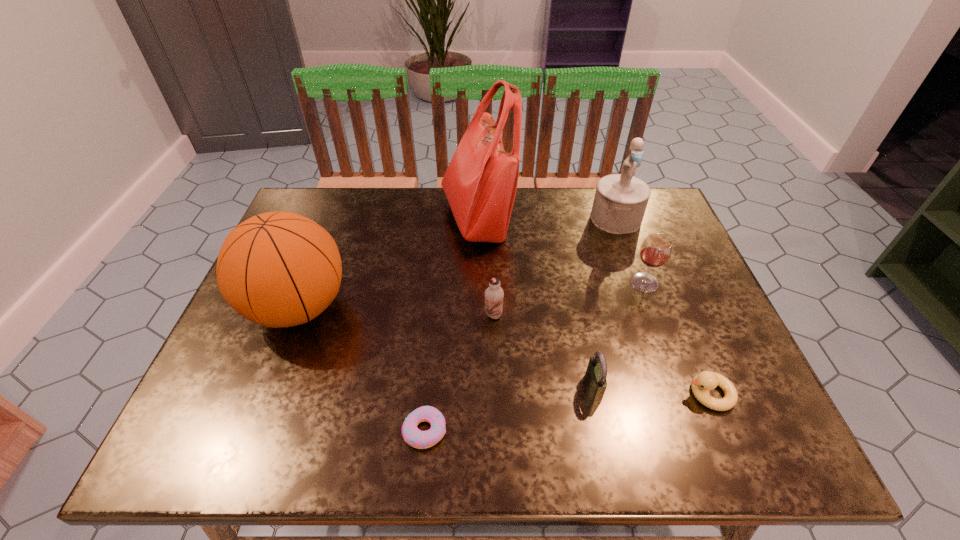
Image resolution: width=960 pixels, height=540 pixels. In order to click on free location located on the front of the leftmost object in this screenshot , I will do `click(260, 409)`.

This screenshot has width=960, height=540. I want to click on free space located 0.370m on the left of the wineglass, so click(486, 282).

Identify the location of vacant position located 0.220m on the back of the chocolate milk. This screenshot has width=960, height=540. (492, 248).

Where is `vacant space situated on the right of the padlock`? The height and width of the screenshot is (540, 960). vacant space situated on the right of the padlock is located at coordinates (677, 388).

This screenshot has height=540, width=960. Identify the location of free spot located 0.230m at the beak of the duckling. point(572,394).

This screenshot has height=540, width=960. In order to click on vacant space situated 0.080m at the beak of the duckling in this screenshot , I will do `click(646, 394)`.

Where is `vacant space located at the beak of the duckling`? This screenshot has width=960, height=540. vacant space located at the beak of the duckling is located at coordinates (616, 394).

Where is `vacant space located on the back of the doughnut`? The image size is (960, 540). vacant space located on the back of the doughnut is located at coordinates (432, 349).

Where is `handbag situated at the far edge`? The image size is (960, 540). handbag situated at the far edge is located at coordinates (480, 183).

This screenshot has width=960, height=540. I want to click on figurine present at the far edge, so click(x=620, y=201).